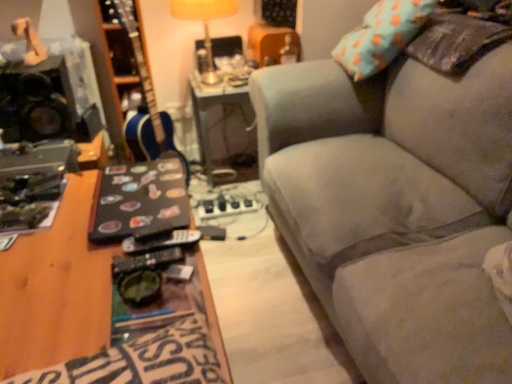
Measure the distance between point (4, 123) and camera.

Point (4, 123) and camera are 1.71 meters apart from each other.

What do you see at coordinates (36, 101) in the screenshot?
I see `black matte speaker at left` at bounding box center [36, 101].

Locate an element on the screen. This screenshot has width=512, height=384. yellow fabric lampshade at upper center is located at coordinates (205, 25).

I want to click on metallic silver table at center, so click(x=222, y=127).

In order to face velvet gray couch at right, should I rotate leftwards or rightwards?

To face it directly, rotate right by 22.705 degrees.

Find the location of a particular element. velvet gray couch at right is located at coordinates (399, 200).

At what (x,y) coordinates should I click in order to perform the action: click on black matte speaker at left. Please return your answer as a coordinate pair (x, y). Looking at the image, I should click on (36, 101).

Is metallic silver table at center aimed at black matte speaker at left?

No, metallic silver table at center is not facing towards black matte speaker at left.

Which object is closer to the camera, metallic silver table at center or black matte speaker at left?

black matte speaker at left is closer to the camera.

Which of these two, metallic silver table at center or black matte speaker at left, is thinner?

Thinner between the two is black matte speaker at left.

Is point (206, 99) positioned before point (25, 120)?

No, (206, 99) is behind (25, 120).

Would you say black matte speaker at left is inside or outside teal fabric pillow at upper right?

black matte speaker at left lies outside teal fabric pillow at upper right.

Which of these two, black matte speaker at left or teal fabric pillow at upper right, stands taller?

teal fabric pillow at upper right.

Is the surface of black matte speaker at left in direct contact with teal fabric pillow at upper right?

black matte speaker at left and teal fabric pillow at upper right are not in contact.

Considering the relative sizes of black matte speaker at left and teal fabric pillow at upper right in the image provided, is black matte speaker at left thinner than teal fabric pillow at upper right?

No.

Would you consider black matte speaker at left to be distant from blue glossy guitar at center?

Actually, black matte speaker at left and blue glossy guitar at center are a little close together.

Measure the distance between black matte speaker at left and blue glossy guitar at center.

The distance of black matte speaker at left from blue glossy guitar at center is 14.31 inches.

Which of these two, black matte speaker at left or blue glossy guitar at center, is wider?

black matte speaker at left.

Is black matte speaker at left facing towards blue glossy guitar at center?

No, black matte speaker at left does not turn towards blue glossy guitar at center.

Is blue glossy guitar at center to the right of black matte speaker at left from the viewer's perspective?

Yes, blue glossy guitar at center is to the right of black matte speaker at left.

Does point (131, 33) come farther from viewer compared to point (58, 116)?

Yes, point (131, 33) is behind point (58, 116).

Looking at this image, is blue glossy guitar at center inside the boundaries of black matte speaker at left, or outside?

blue glossy guitar at center is outside black matte speaker at left.

Considering the relative sizes of blue glossy guitar at center and black matte speaker at left in the image provided, is blue glossy guitar at center taller than black matte speaker at left?

Indeed, blue glossy guitar at center has a greater height compared to black matte speaker at left.

Locate an element on the screen. The height and width of the screenshot is (384, 512). studio couch below the metallic silver table at center (from the image's perspective) is located at coordinates (399, 200).

In terms of height, does velvet gray couch at right look taller or shorter compared to metallic silver table at center?

velvet gray couch at right is taller than metallic silver table at center.

Is velvet gray couch at right aimed at metallic silver table at center?

No, velvet gray couch at right is not turned towards metallic silver table at center.

Is teal fabric pillow at upper right spatially inside velvet gray couch at right, or outside of it?

teal fabric pillow at upper right is contained in velvet gray couch at right.

Which of these two, teal fabric pillow at upper right or velvet gray couch at right, is wider?

velvet gray couch at right.

What's the angular difference between teal fabric pillow at upper right and velvet gray couch at right's facing directions?

7.28 degrees separate the facing orientations of teal fabric pillow at upper right and velvet gray couch at right.

Where is `pillow located above the velvet gray couch at right (from a real-world perspective)`? This screenshot has width=512, height=384. pillow located above the velvet gray couch at right (from a real-world perspective) is located at coordinates (381, 36).

Is velvet gray couch at right positioned far away from yellow fabric lampshade at upper center?

velvet gray couch at right is near yellow fabric lampshade at upper center, not far away.

From a real-world perspective, does velvet gray couch at right sit lower than yellow fabric lampshade at upper center?

Yes, from a real-world perspective, velvet gray couch at right is below yellow fabric lampshade at upper center.

Is velvet gray couch at right not within yellow fabric lampshade at upper center?

Yes.

The height and width of the screenshot is (384, 512). Find the location of `loudspeaker in front of the metallic silver table at center`. loudspeaker in front of the metallic silver table at center is located at coordinates (36, 101).

At what (x,y) coordinates should I click in order to perform the action: click on pillow above the black matte speaker at left (from the image's perspective). Please return your answer as a coordinate pair (x, y). Looking at the image, I should click on (381, 36).

When comparing their distances from metallic silver table at center, does blue glossy guitar at center or velvet gray couch at right seem further?

velvet gray couch at right.

Looking at the image, which one is located closer to yellow fabric lampshade at upper center, blue glossy guitar at center or metallic silver table at center?

blue glossy guitar at center is positioned closer to the anchor yellow fabric lampshade at upper center.

Based on their spatial positions, is teal fabric pillow at upper right or metallic silver table at center further from black matte speaker at left?

teal fabric pillow at upper right.

When comparing their distances from blue glossy guitar at center, does velvet gray couch at right or metallic silver table at center seem closer?

The object closer to blue glossy guitar at center is metallic silver table at center.

Estimate the real-world distances between objects in this image. Which object is further from velvet gray couch at right, yellow fabric lampshade at upper center or teal fabric pillow at upper right?

yellow fabric lampshade at upper center.

From the image, which object appears to be nearer to metallic silver table at center, yellow fabric lampshade at upper center or velvet gray couch at right?

yellow fabric lampshade at upper center is closer to metallic silver table at center.

From the image, which object appears to be nearer to black matte speaker at left, metallic silver table at center or yellow fabric lampshade at upper center?

yellow fabric lampshade at upper center is positioned closer to the anchor black matte speaker at left.

From the image, which object appears to be nearer to teal fabric pillow at upper right, blue glossy guitar at center or black matte speaker at left?

blue glossy guitar at center is closer to teal fabric pillow at upper right.

The height and width of the screenshot is (384, 512). What are the coordinates of `table between yellow fabric lampshade at upper center and teal fabric pillow at upper right from left to right` in the screenshot? It's located at (222, 127).

Where is `lamp between black matte speaker at left and metallic silver table at center in the horizontal direction`? Image resolution: width=512 pixels, height=384 pixels. lamp between black matte speaker at left and metallic silver table at center in the horizontal direction is located at coordinates (205, 25).

You are a GUI agent. You are given a task and a screenshot of the screen. Output one action in this format:
    pyautogui.click(x=<x>, y=<y>)
    Task: Click on the guitar situated between black matte speaker at left and metallic silver table at center from left to right
    This screenshot has width=512, height=384.
    Given the screenshot: What is the action you would take?
    pyautogui.click(x=146, y=105)

Where is `guitar between black matte speaker at left and teal fabric pillow at upper right from left to right`? The image size is (512, 384). guitar between black matte speaker at left and teal fabric pillow at upper right from left to right is located at coordinates (146, 105).